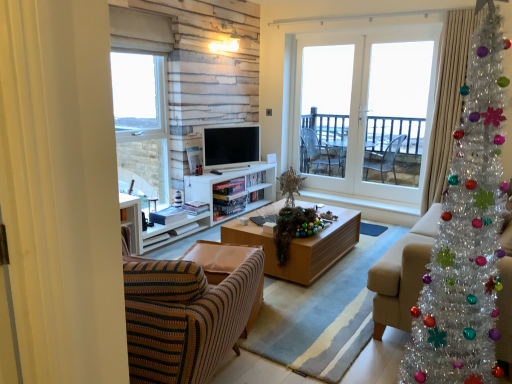
Question: Is clear glass window at upper left, which is counted as the second window, starting from the right, bigger or smaller than white glass door at center, which is counted as the 1th window, starting from the right?

Choices:
 (A) big
 (B) small

Answer: (A)

Question: In terms of height, does clear glass window at upper left, the 1th window in the left-to-right sequence, look taller or shorter compared to white glass door at center, which is counted as the 1th window, starting from the right?

Choices:
 (A) tall
 (B) short

Answer: (B)

Question: Estimate the real-world distances between objects in this image. Which object is farther from the clear glass door at center, the 2th screen door when ordered from right to left?

Choices:
 (A) white glass screen door at center, arranged as the 2th screen door when viewed from the left
 (B) silky beige curtain at right
 (C) beige fabric couch at right
 (D) white matte entertainment center at center
 (E) matte white television at center

Answer: (C)

Question: Which object is positioned closest to the white matte entertainment center at center?

Choices:
 (A) white glass screen door at center, which is the first screen door in right-to-left order
 (B) matte white television at center
 (C) clear glass door at center, the first screen door positioned from the left
 (D) shiny tinsel garland at center
 (E) silky beige curtain at right

Answer: (B)